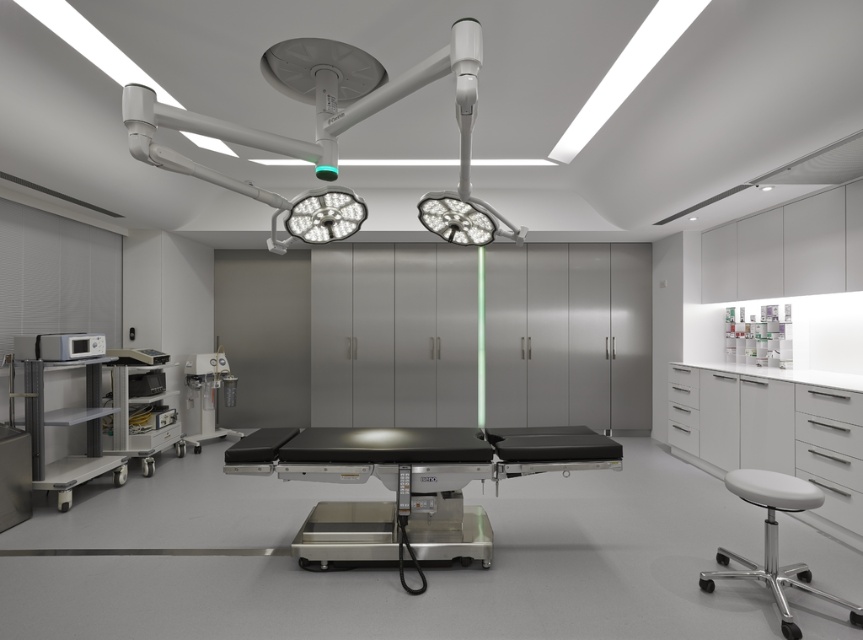
Is point (335, 125) behind point (91, 349)?

No, (335, 125) is closer to viewer.

What do you see at coordinates (332, 134) in the screenshot? I see `white matte surgical light at upper center` at bounding box center [332, 134].

Image resolution: width=863 pixels, height=640 pixels. Find the location of `white matte surgical light at upper center`. white matte surgical light at upper center is located at coordinates (332, 134).

Who is taller, black matte surgical table at center or matte silver oxygen tank at center-left?

With more height is matte silver oxygen tank at center-left.

Consider the image. Is black matte surgical table at center bigger than matte silver oxygen tank at center-left?

Correct, black matte surgical table at center is larger in size than matte silver oxygen tank at center-left.

Is point (526, 451) closer to viewer compared to point (213, 362)?

Yes, point (526, 451) is closer to viewer.

The width and height of the screenshot is (863, 640). I want to click on black matte surgical table at center, so click(408, 483).

Who is shorter, metallic gray cart at left or white plastic cart at left?

Standing shorter between the two is white plastic cart at left.

Does metallic gray cart at left appear on the right side of white plastic cart at left?

No, metallic gray cart at left is not to the right of white plastic cart at left.

Who is more forward, (93, 368) or (123, 387)?

Positioned in front is point (93, 368).

Image resolution: width=863 pixels, height=640 pixels. Identify the location of metallic gray cart at left. (66, 410).